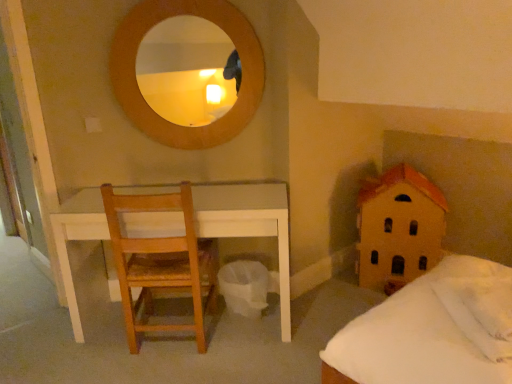
The image size is (512, 384). What are the coordinates of `free location above white soft pillow at lower right, which ranks as the second pillow in back-to-front order (from a real-world perspective)` in the screenshot? It's located at (481, 302).